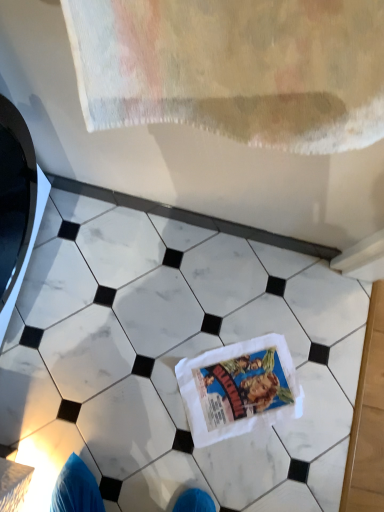
Where is `free space to the right of white cotton comic book at center`? This screenshot has height=512, width=384. free space to the right of white cotton comic book at center is located at coordinates (326, 409).